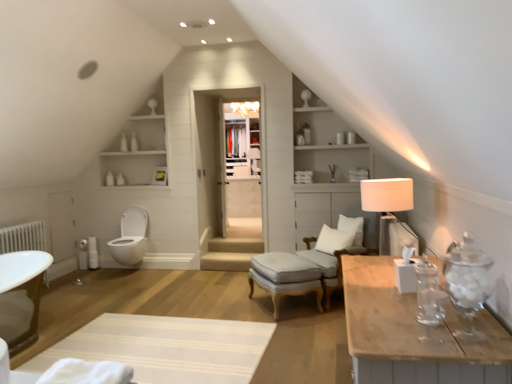
Measure the distance between white soft cushion at center, the first pillow from the bottom, and camera.

14.01 feet.

Measure the distance between point (133, 151) and camera.

The distance of point (133, 151) from camera is 6.08 meters.

This screenshot has height=384, width=512. What do you see at coordinates (138, 148) in the screenshot?
I see `white wood shelves at upper left` at bounding box center [138, 148].

What is the approximate height of white wood shelves at upper center?

4.67 feet.

Identify the location of white textured rug at lower center. (165, 348).

Describe the element at coordinates (222, 167) in the screenshot. I see `clear glass door at center` at that location.

Image resolution: width=512 pixels, height=384 pixels. In order to click on white soft cushion at center, the first pillow from the bottom in this screenshot , I will do `click(334, 240)`.

Between point (281, 286) and point (346, 227), which one is positioned in front?

The point (281, 286) is in front.

From the image's perspective, which object appears higher, light gray fabric stool at center or white soft pillow at center, placed as the 2th pillow when sorted from bottom to top?

white soft pillow at center, placed as the 2th pillow when sorted from bottom to top, is shown above in the image.

Where is `stool below the white soft pillow at center, which is the 1th pillow in top-to-bottom order (from the image's perspective)`? stool below the white soft pillow at center, which is the 1th pillow in top-to-bottom order (from the image's perspective) is located at coordinates (285, 277).

What's the angular difference between light gray fabric stool at center and white soft pillow at center, which is the 1th pillow in top-to-bottom order,'s facing directions?

0.0188 degrees.

Locate an element on the screen. the 2nd pillow directly above the white fabric swivel chair at center-right (from a real-world perspective) is located at coordinates (352, 227).

Can you confirm if white fabric swivel chair at center-right is positioned to the left of white soft pillow at center, which is the 1th pillow in top-to-bottom order?

Indeed, white fabric swivel chair at center-right is positioned on the left side of white soft pillow at center, which is the 1th pillow in top-to-bottom order.

Who is shorter, white fabric swivel chair at center-right or white soft pillow at center, which is the 1th pillow in top-to-bottom order?

With less height is white soft pillow at center, which is the 1th pillow in top-to-bottom order.

In the scene shown: From a real-world perspective, is white fabric swivel chair at center-right above or below white soft pillow at center, which is the 1th pillow in top-to-bottom order?

white fabric swivel chair at center-right is below white soft pillow at center, which is the 1th pillow in top-to-bottom order.

Can you confirm if white wood shelves at upper center is smaller than white soft pillow at center, placed as the 2th pillow when sorted from bottom to top?

No, white wood shelves at upper center is not smaller than white soft pillow at center, placed as the 2th pillow when sorted from bottom to top.

Considering the relative sizes of white wood shelves at upper center and white soft pillow at center, which is the 1th pillow in top-to-bottom order, in the image provided, is white wood shelves at upper center thinner than white soft pillow at center, which is the 1th pillow in top-to-bottom order,?

In fact, white wood shelves at upper center might be wider than white soft pillow at center, which is the 1th pillow in top-to-bottom order.

Is white wood shelves at upper center to the right of white soft pillow at center, which is the 1th pillow in top-to-bottom order, from the viewer's perspective?

Incorrect, white wood shelves at upper center is not on the right side of white soft pillow at center, which is the 1th pillow in top-to-bottom order.

Is white wood shelves at upper center oriented away from white soft pillow at center, placed as the 2th pillow when sorted from bottom to top?

white wood shelves at upper center does not have its back to white soft pillow at center, placed as the 2th pillow when sorted from bottom to top.

Is white soft pillow at center, which is the 1th pillow in top-to-bottom order, in front of white textured rug at lower center?

That is False.

How different are the orientations of white soft pillow at center, placed as the 2th pillow when sorted from bottom to top, and white textured rug at lower center in degrees?

124 degrees separate the facing orientations of white soft pillow at center, placed as the 2th pillow when sorted from bottom to top, and white textured rug at lower center.

From the image's perspective, is white soft pillow at center, which is the 1th pillow in top-to-bottom order, on white textured rug at lower center?

Yes, from the image's perspective, white soft pillow at center, which is the 1th pillow in top-to-bottom order, is above white textured rug at lower center.

Can you confirm if white soft pillow at center, which is the 1th pillow in top-to-bottom order, is smaller than white textured rug at lower center?

Yes, white soft pillow at center, which is the 1th pillow in top-to-bottom order, is smaller than white textured rug at lower center.

Is white soft cushion at center, the first pillow from the bottom, not near white fabric swivel chair at center-right?

white soft cushion at center, the first pillow from the bottom, is near white fabric swivel chair at center-right, not far away.

Based on their sizes in the image, would you say white soft cushion at center, which appears as the 2th pillow when viewed from the top, is bigger or smaller than white fabric swivel chair at center-right?

Clearly, white soft cushion at center, which appears as the 2th pillow when viewed from the top, is smaller in size than white fabric swivel chair at center-right.

Between point (350, 239) and point (309, 238), which one is positioned behind?

Point (309, 238)

This screenshot has height=384, width=512. I want to click on toilet lying below the white soft pillow at center, which is the 1th pillow in top-to-bottom order (from the image's perspective), so click(x=131, y=237).

Would you say white glossy toilet at lower left is a long distance from white soft pillow at center, placed as the 2th pillow when sorted from bottom to top?

Indeed, white glossy toilet at lower left is not near white soft pillow at center, placed as the 2th pillow when sorted from bottom to top.

Could you tell me if white glossy toilet at lower left is facing white soft pillow at center, which is the 1th pillow in top-to-bottom order?

No, white glossy toilet at lower left is not aimed at white soft pillow at center, which is the 1th pillow in top-to-bottom order.

Is white wood shelves at upper center outside of white fabric lampshade at right?

That's correct, white wood shelves at upper center is outside of white fabric lampshade at right.

Between point (323, 220) and point (387, 227), which one is positioned behind?

The point (323, 220) is more distant.

From the image's perspective, would you say white wood shelves at upper center is positioned over white fabric lampshade at right?

Yes, from the image's perspective, white wood shelves at upper center is on top of white fabric lampshade at right.

Is white wood shelves at upper center taller or shorter than white fabric lampshade at right?

Clearly, white wood shelves at upper center is taller compared to white fabric lampshade at right.

Where is `the 2nd pillow to the right of the light gray fabric stool at center, starting your count from the anchor`? Image resolution: width=512 pixels, height=384 pixels. the 2nd pillow to the right of the light gray fabric stool at center, starting your count from the anchor is located at coordinates (352, 227).

This screenshot has height=384, width=512. I want to click on swivel chair below the white soft pillow at center, placed as the 2th pillow when sorted from bottom to top (from the image's perspective), so click(x=334, y=251).

From the image, which object appears to be nearer to white fabric swivel chair at center-right, white soft cushion at center, the first pillow from the bottom, or clear glass door at center?

white soft cushion at center, the first pillow from the bottom, is closer to white fabric swivel chair at center-right.

Estimate the real-world distances between objects in this image. Which object is further from white glossy toilet at lower left, white fabric swivel chair at center-right or white wood shelves at upper center?

white fabric swivel chair at center-right is positioned further to the anchor white glossy toilet at lower left.

When comparing their distances from white fabric lampshade at right, does white wood drawer at center or white soft cushion at center, the first pillow from the bottom, seem further?

The object further to white fabric lampshade at right is white wood drawer at center.

Looking at the image, which one is located closer to white fabric lampshade at right, white wood shelves at upper left or white wood drawer at center?

The object closer to white fabric lampshade at right is white wood drawer at center.

Which object lies nearer to the anchor point white textured rug at lower center, white soft cushion at center, which appears as the 2th pillow when viewed from the top, or light gray fabric stool at center?

The object closer to white textured rug at lower center is light gray fabric stool at center.

In the scene shown: Based on their spatial positions, is white fabric lampshade at right or light gray fabric stool at center closer to clear glass door at center?

Based on the image, light gray fabric stool at center appears to be nearer to clear glass door at center.

Considering their positions, is white wood shelves at upper center positioned closer to white wood drawer at center than white soft cushion at center, the first pillow from the bottom?

The object closer to white wood drawer at center is white wood shelves at upper center.

Looking at the image, which one is located further to white fabric swivel chair at center-right, clear glass door at center or white textured rug at lower center?

clear glass door at center is further to white fabric swivel chair at center-right.

Identify the location of glass door between white glossy toilet at lower left and white fabric swivel chair at center-right. This screenshot has width=512, height=384. (222, 167).

Identify the location of dresser positioned between white textured rug at lower center and white wood drawer at center from near to far. The height and width of the screenshot is (384, 512). (326, 170).

You are a GUI agent. You are given a task and a screenshot of the screen. Output one action in this format:
    pyautogui.click(x=<x>, y=<y>)
    Task: Click on the dresser between white soft cushion at center, which appears as the 2th pillow when viewed from the top, and white wood drawer at center, along the z-axis
    
    Given the screenshot: What is the action you would take?
    pyautogui.click(x=326, y=170)

What are the coordinates of `toilet between white textured rug at lower center and white wood drawer at center from front to back` in the screenshot? It's located at (131, 237).